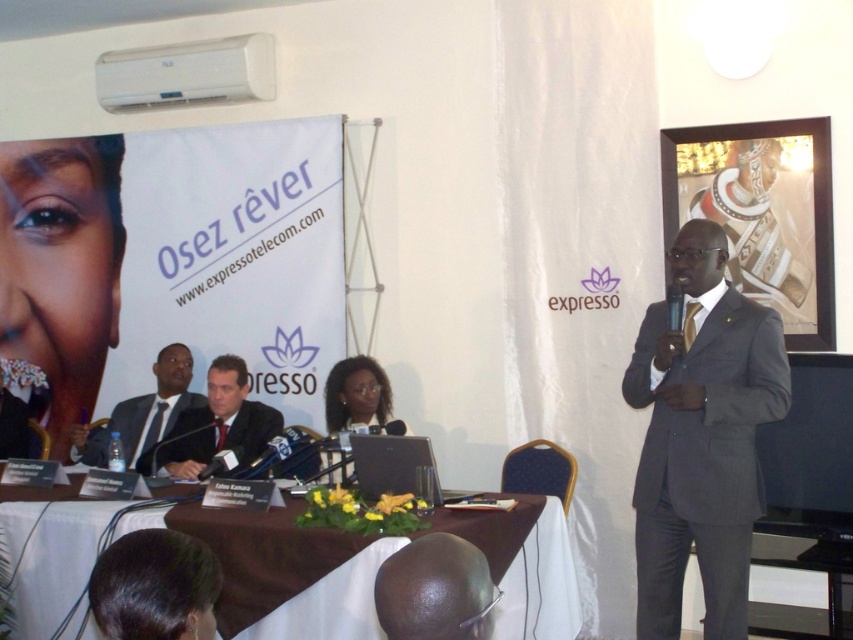
Question: Which point appears farthest from the camera in this image?

Choices:
 (A) (39, 196)
 (B) (247, 436)
 (C) (741, 364)
 (D) (296, 612)

Answer: (A)

Question: Does matte black laptop at center appear on the right side of dark gray suit at lower left?

Choices:
 (A) no
 (B) yes

Answer: (B)

Question: Does gray pinstripe suit at right have a lesser width compared to white cloth-covered table at center?

Choices:
 (A) no
 (B) yes

Answer: (B)

Question: Which of the following is the closest to the observer?

Choices:
 (A) (717, 624)
 (B) (30, 573)
 (C) (106, 428)
 (D) (91, 317)

Answer: (A)

Question: Is white cloth-covered table at center closer to camera compared to dark gray suit at lower left?

Choices:
 (A) yes
 (B) no

Answer: (A)

Question: Which object appears farthest from the camera in this image?

Choices:
 (A) matte black laptop at center
 (B) gray pinstripe suit at right
 (C) matte black face at left

Answer: (C)